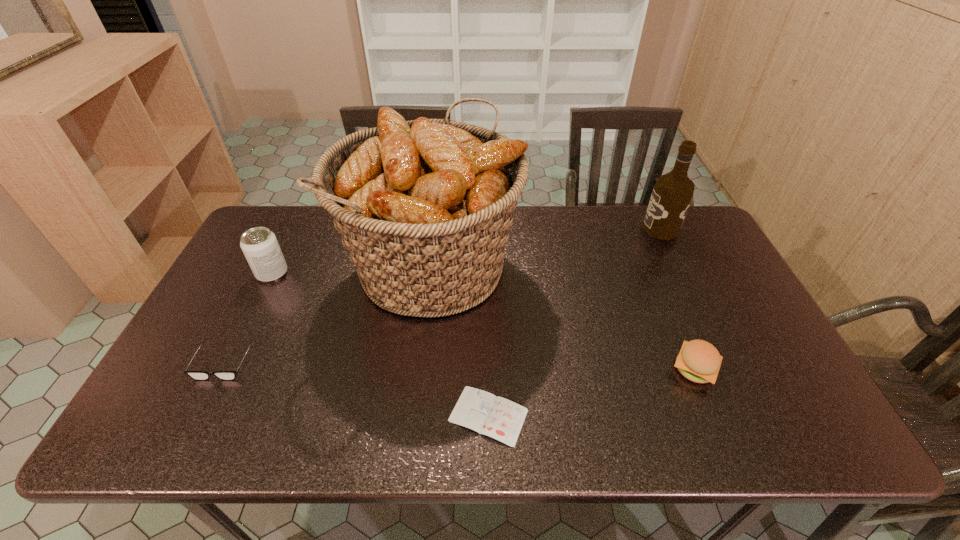
This screenshot has width=960, height=540. I want to click on basket, so click(424, 207).

Identify the location of alcohol. This screenshot has width=960, height=540. (672, 193).

At what (x,y) coordinates should I click in order to perform the action: click on soda can. Please return your answer as a coordinate pair (x, y). This screenshot has height=540, width=960. Looking at the image, I should click on click(260, 246).

Find the location of a particular element. This screenshot has height=540, width=960. hamburger is located at coordinates (699, 361).

Image resolution: width=960 pixels, height=540 pixels. Identify the location of the second shortest object. (196, 375).

Locate an element on the screen. This screenshot has height=540, width=960. the shortest object is located at coordinates (499, 418).

Locate an element on the screen. The width and height of the screenshot is (960, 540). vacant region located 0.250m on the left of the tallest object is located at coordinates (262, 265).

The height and width of the screenshot is (540, 960). I want to click on vacant point located on the label of the alcohol, so click(x=572, y=229).

Image resolution: width=960 pixels, height=540 pixels. Identify the location of vacant region located on the label of the alcohol. (584, 229).

Find the location of `free space located on the label of the alcohol`. free space located on the label of the alcohol is located at coordinates (528, 229).